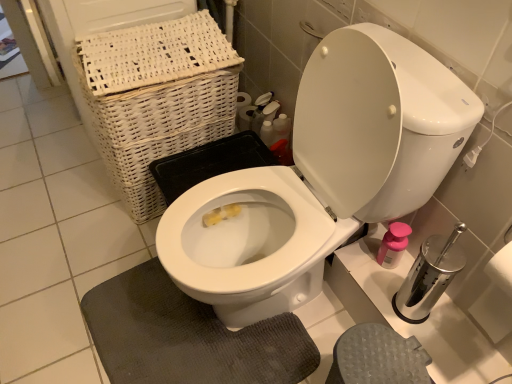
Question: Could you tell me if silver metallic toilet paper at right is turned towards gray textured bath mat at lower center?

Choices:
 (A) yes
 (B) no

Answer: (B)

Question: Considering the relative positions of silver metallic toilet paper at right and gray textured bath mat at lower center in the image provided, is silver metallic toilet paper at right to the left of gray textured bath mat at lower center from the viewer's perspective?

Choices:
 (A) no
 (B) yes

Answer: (A)

Question: Is silver metallic toilet paper at right not close to gray textured bath mat at lower center?

Choices:
 (A) no
 (B) yes

Answer: (A)

Question: Is gray textured bath mat at lower center a part of silver metallic toilet paper at right?

Choices:
 (A) yes
 (B) no

Answer: (B)

Question: From the image's perspective, is silver metallic toilet paper at right beneath gray textured bath mat at lower center?

Choices:
 (A) no
 (B) yes

Answer: (A)

Question: Does point (162, 274) appear closer or farther from the camera than point (504, 299)?

Choices:
 (A) farther
 (B) closer

Answer: (A)

Question: In the image, is gray textured bath mat at lower center on the left side or the right side of silver metallic toilet paper at right?

Choices:
 (A) right
 (B) left

Answer: (B)

Question: From a real-world perspective, is gray textured bath mat at lower center above or below silver metallic toilet paper at right?

Choices:
 (A) below
 (B) above

Answer: (A)

Question: Which is correct: gray textured bath mat at lower center is inside silver metallic toilet paper at right, or outside of it?

Choices:
 (A) outside
 (B) inside

Answer: (A)

Question: Is point (178, 382) positioned closer to the camera than point (394, 254)?

Choices:
 (A) farther
 (B) closer

Answer: (B)

Question: From their relative heights in the image, would you say gray textured bath mat at lower center is taller or shorter than pink plastic soap dispenser at right?

Choices:
 (A) short
 (B) tall

Answer: (A)

Question: Looking at their shapes, would you say gray textured bath mat at lower center is wider or thinner than pink plastic soap dispenser at right?

Choices:
 (A) wide
 (B) thin

Answer: (A)

Question: From the image's perspective, is gray textured bath mat at lower center above or below pink plastic soap dispenser at right?

Choices:
 (A) above
 (B) below

Answer: (B)

Question: Which is correct: white wicker basket at upper left is inside pink plastic soap dispenser at right, or outside of it?

Choices:
 (A) inside
 (B) outside

Answer: (B)

Question: Visually, is white wicker basket at upper left positioned to the left or to the right of pink plastic soap dispenser at right?

Choices:
 (A) right
 (B) left

Answer: (B)